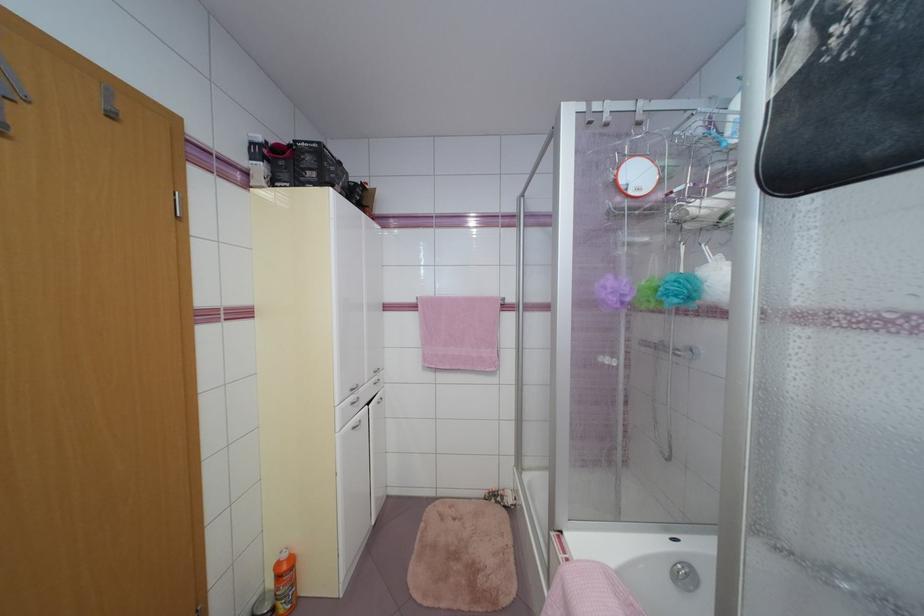
Locate an element on the screen. This screenshot has width=924, height=616. blue loofah is located at coordinates (675, 328).